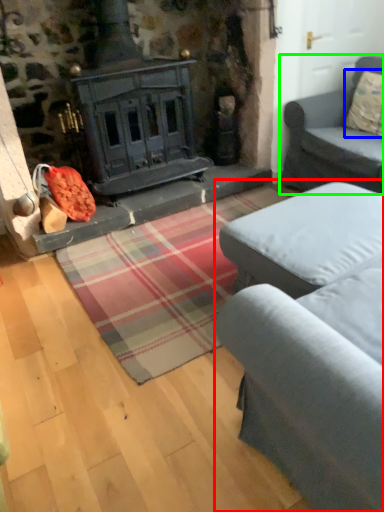
Question: Which object is positioned farthest from studio couch (highlighted by a red box)? Select from pillow (highlighted by a blue box) and studio couch (highlighted by a green box).

Choices:
 (A) pillow
 (B) studio couch

Answer: (A)